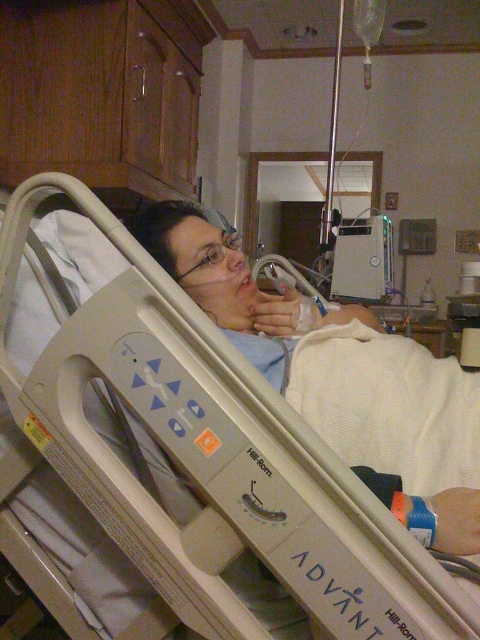
Question: Is beige plastic bed at center above clear plastic glasses at center?

Choices:
 (A) yes
 (B) no

Answer: (B)

Question: Is metallic silver air purifier at upper center thinner than clear plastic glasses at center?

Choices:
 (A) no
 (B) yes

Answer: (A)

Question: Which of these objects is positioned farthest from the metallic silver air purifier at upper center?

Choices:
 (A) beige plastic bed at center
 (B) clear plastic glasses at center

Answer: (A)

Question: Does metallic silver air purifier at upper center have a greater width compared to clear plastic glasses at center?

Choices:
 (A) yes
 (B) no

Answer: (A)

Question: Estimate the real-world distances between objects in this image. Which object is closer to the clear plastic glasses at center?

Choices:
 (A) metallic silver air purifier at upper center
 (B) beige plastic bed at center

Answer: (B)

Question: Among these points, which one is farthest from the camera?

Choices:
 (A) (140, 426)
 (B) (352, 285)

Answer: (B)